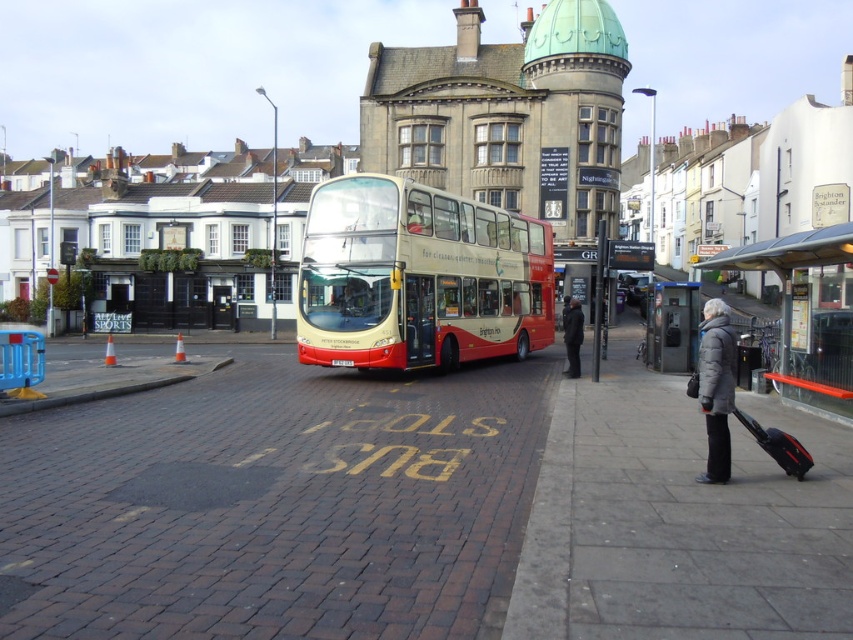
Question: Is metallic gray bus stop at center in front of black fabric coat at center?

Choices:
 (A) no
 (B) yes

Answer: (A)

Question: Is brick pavement at center to the left of metallic gray bus stop at center from the viewer's perspective?

Choices:
 (A) no
 (B) yes

Answer: (B)

Question: Based on their relative distances, which object is nearer to the matte cream double-decker bus at center?

Choices:
 (A) gray concrete sidewalk at lower right
 (B) brick pavement at center
 (C) black hardshell suitcase at lower right
 (D) metallic gray bus stop at center

Answer: (B)

Question: Considering the real-world distances, which object is closest to the black fabric coat at center?

Choices:
 (A) brick pavement at center
 (B) metallic gray bus stop at center
 (C) matte cream double-decker bus at center

Answer: (B)

Question: Can you confirm if brick pavement at center is positioned to the right of black hardshell suitcase at lower right?

Choices:
 (A) yes
 (B) no

Answer: (B)

Question: Among these points, which one is nearest to the camera?

Choices:
 (A) (566, 312)
 (B) (10, 572)
 (C) (477, 208)
 (D) (796, 296)

Answer: (B)